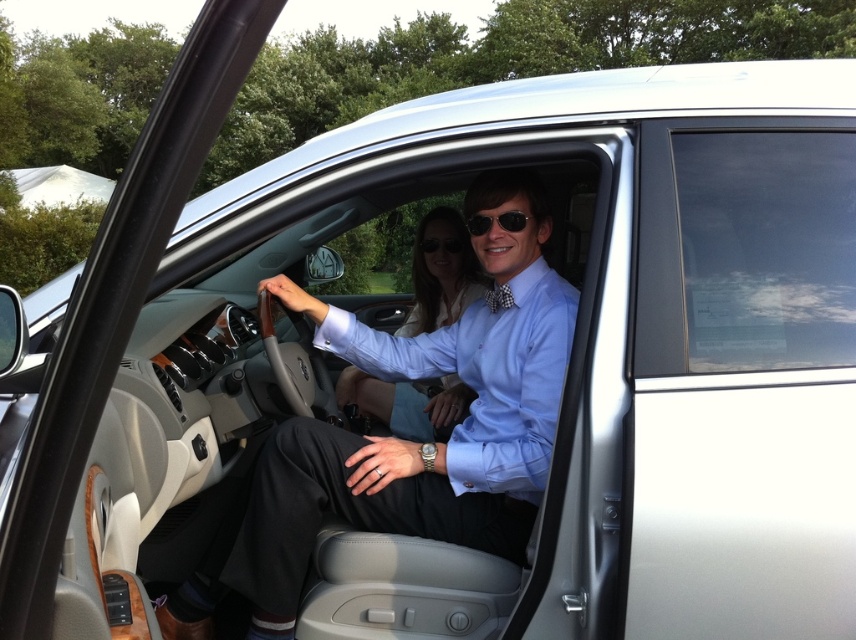
Based on the photo, you are a delivery robot that needs to place a small package between the light blue shirt at center and the black plastic sunglasses at center. The package is 1.2 meters long. Can you fit it between them?

The distance between the light blue shirt at center and the black plastic sunglasses at center is 1.17 meters. Since the package is 1.2 meters long, it cannot fit between them as the space is slightly smaller than the package.

You are a passenger in the car and want to hand the driver your sunglasses. Which object should you pass first, the light blue cotton dress shirt at center or the black plastic sunglasses at center?

The light blue cotton dress shirt at center is in front of the black plastic sunglasses at center, so you should pass the black plastic sunglasses at center first as it is behind the shirt.

You are a passenger in the car and want to hand your sunglasses to the driver. Given that the light blue shirt at center is on the left side of the black plastic sunglasses at center, can you directly hand them over without moving your seat forward?

The light blue shirt at center is positioned on the left side of the black plastic sunglasses at center. Since the driver is sitting to the left of the passenger, you can directly hand the black plastic sunglasses at center to the driver without needing to move your seat forward.